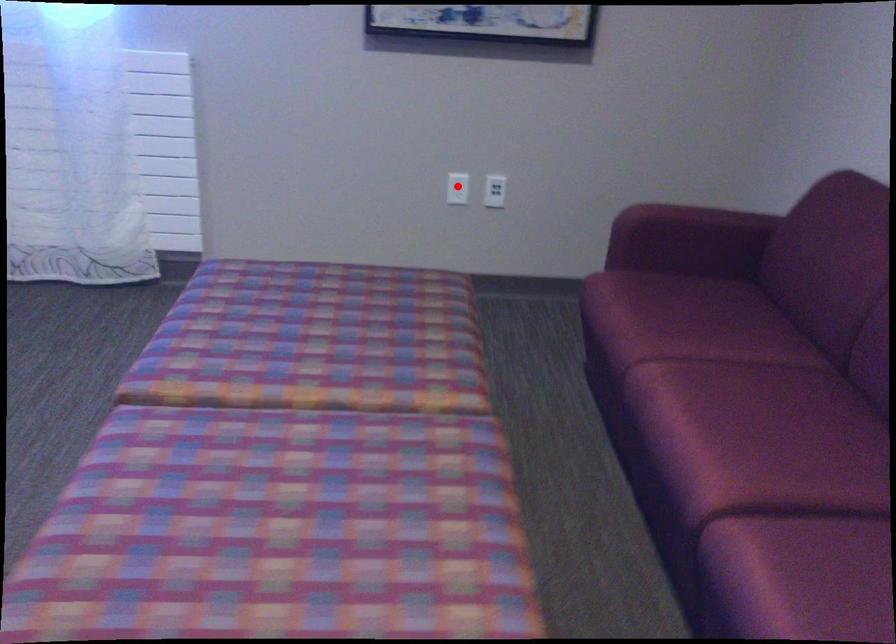
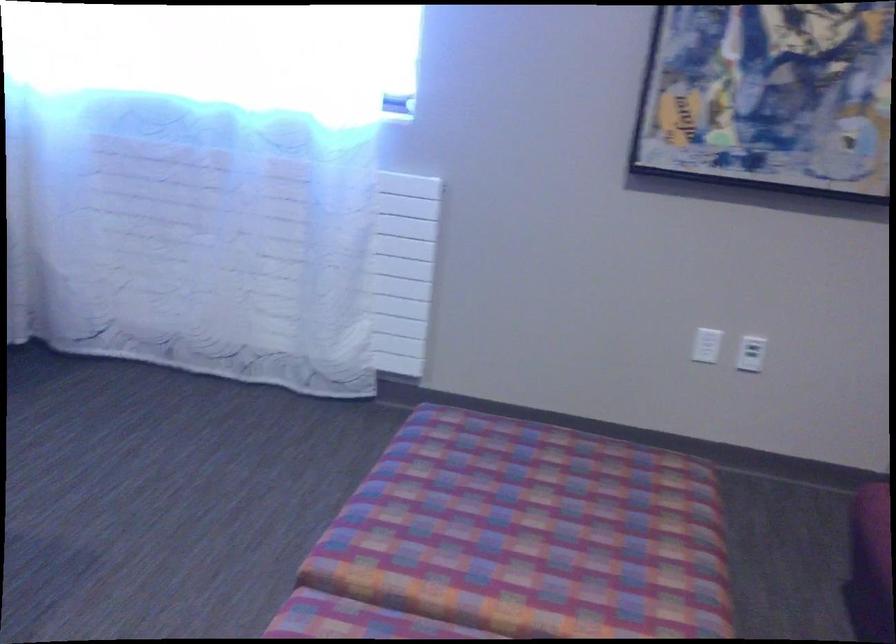
Question: I am providing you with two images of the same scene from different viewpoints. Given a red point in image1, look at the same physical point in image2. Is it:

Choices:
 (A) Closer to the viewpoint
 (B) Farther from the viewpoint

Answer: (A)